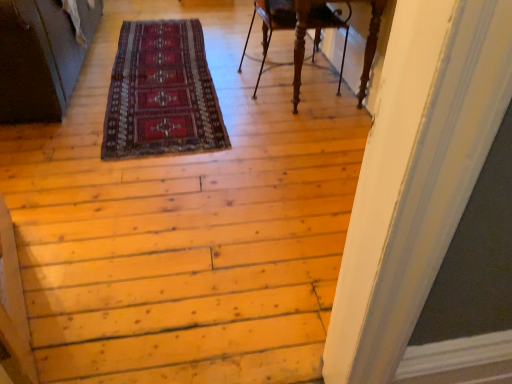
Where is `free point below red woolen rug at center (from a real-world perspective)`? The image size is (512, 384). free point below red woolen rug at center (from a real-world perspective) is located at coordinates (161, 64).